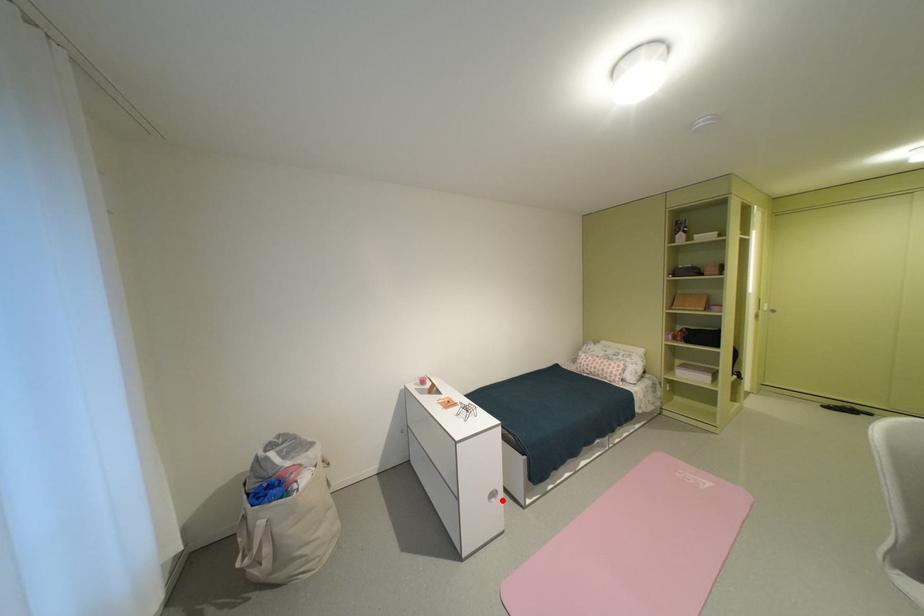
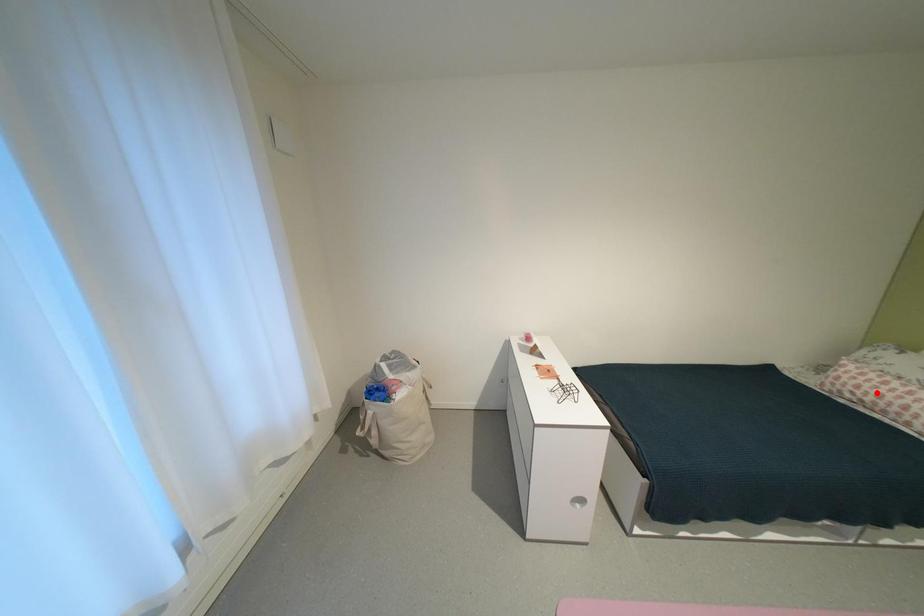
I am providing you with two images of the same scene from different viewpoints. A red point is marked on the first image and another point is marked on the second image. Is the red point in image1 aligned with the point shown in image2?

No